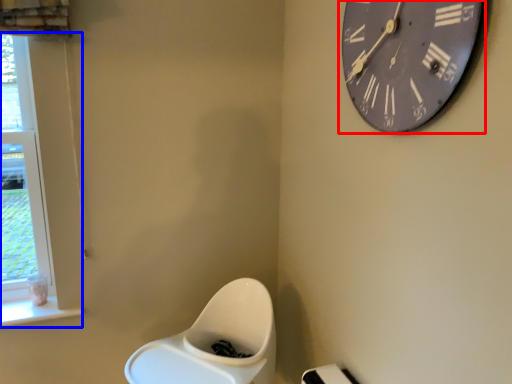
Question: Which object appears closest to the camera in this image, wall clock (highlighted by a red box) or window (highlighted by a blue box)?

Choices:
 (A) wall clock
 (B) window

Answer: (A)